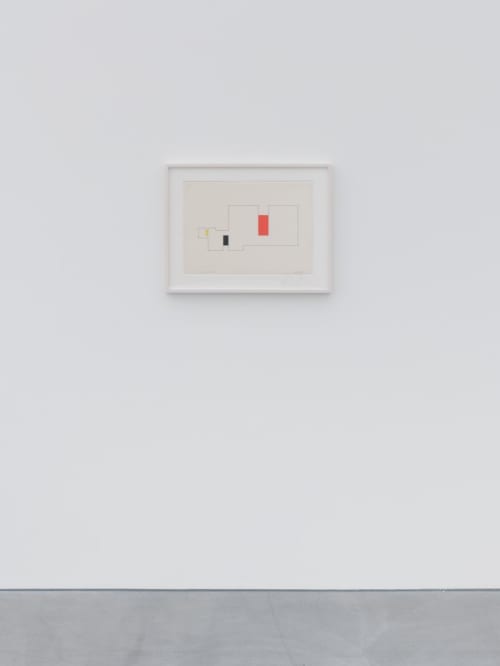
I want to click on wall to left of frame, so click(x=71, y=282).